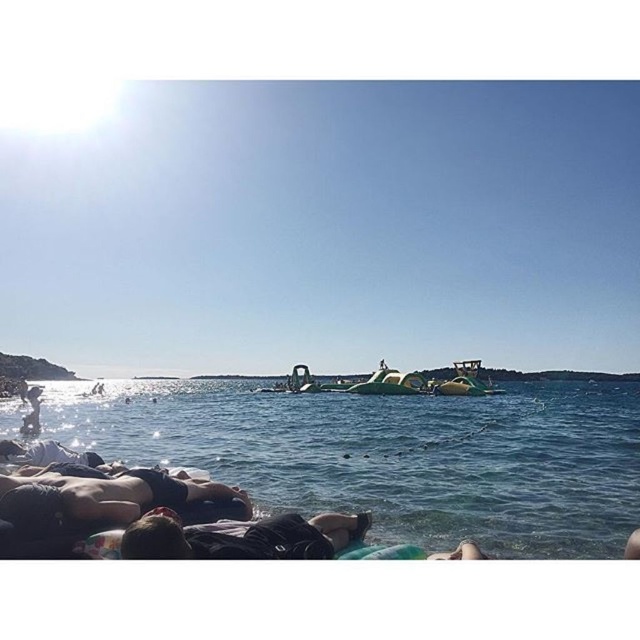
Is clear blue water at lower left behind black fabric person at lower center?

Yes, it is behind black fabric person at lower center.

Is point (579, 483) farther from viewer compared to point (340, 532)?

Yes, point (579, 483) is farther from viewer.

Where is `clear blue water at lower left`? This screenshot has height=640, width=640. clear blue water at lower left is located at coordinates (392, 456).

Is black fabric person at lower center to the right of smooth skin person at lower left from the viewer's perspective?

Indeed, black fabric person at lower center is positioned on the right side of smooth skin person at lower left.

What do you see at coordinates (243, 538) in the screenshot? I see `black fabric person at lower center` at bounding box center [243, 538].

Between point (282, 518) and point (38, 419), which one is positioned behind?

Point (38, 419)

Find the location of a particular element. black fabric person at lower center is located at coordinates (243, 538).

Does clear blue water at lower left have a smaller size compared to smooth skin person at lower left?

No, clear blue water at lower left is not smaller than smooth skin person at lower left.

Which is in front, point (346, 442) or point (36, 424)?

Point (346, 442)

Locate an element on the screen. The image size is (640, 640). clear blue water at lower left is located at coordinates tap(392, 456).